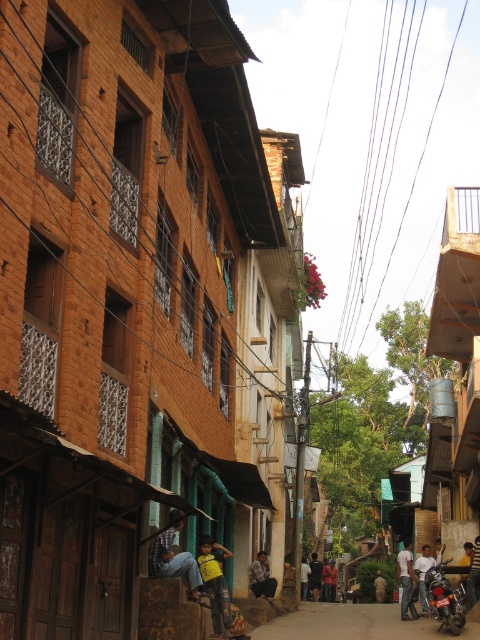
You are a delivery person trying to navigate through the narrow street in the image. You see the dark gray asphalt at center and the denim jeans at center. Which object is closer to you as you walk towards the buildings?

The dark gray asphalt at center is closer to you than the denim jeans at center because the denim jeans at center is behind it.

You are a delivery person standing on the street in the scene. You need to deliver a package to the exact location where the denim jeans at center are located. According to the coordinates provided, where should you aim to place the package?

The denim jeans at center are located at coordinates point (173,557), so you should aim to place the package at that exact point.

You are a delivery person who needs to park your motorcycle on the dark gray asphalt at center. However, there is a 1.2 meter wide motorcycle already parked there. Can you park your motorcycle there if your motorcycle is 1.1 meters wide?

The dark gray asphalt at center is located at point (354,624), so yes, you can park your motorcycle there since it is 1.1 meters wide, which is narrower than the 1.2 meter wide motorcycle already parked there.